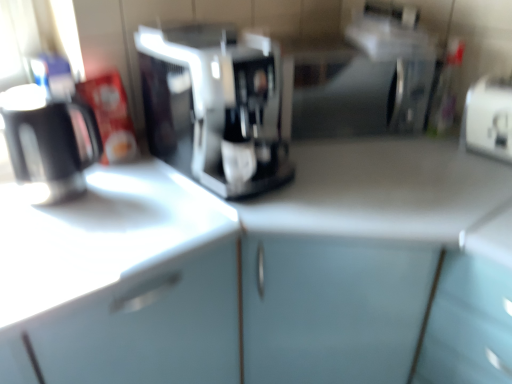
Describe the element at coordinates (97, 239) in the screenshot. The image size is (512, 384). I see `white glossy counter top at left` at that location.

Locate an element on the screen. sleek silver coffee maker at center is located at coordinates (214, 106).

Find the location of a particular element. kitchen appliance lying behind the sleek silver coffee maker at center is located at coordinates (47, 143).

Does matte black mug at left have a greater height compared to sleek silver coffee maker at center?

No, matte black mug at left is not taller than sleek silver coffee maker at center.

Is matte black mug at left outside of sleek silver coffee maker at center?

Yes, matte black mug at left is not within sleek silver coffee maker at center.

From the picture: Does matte black mug at left turn towards sleek silver coffee maker at center?

No, matte black mug at left is not turned towards sleek silver coffee maker at center.

Who is shorter, white glossy counter top at left or matte black mug at left?

With less height is matte black mug at left.

Does white glossy counter top at left come behind matte black mug at left?

No.

Is white glossy counter top at left looking in the opposite direction of matte black mug at left?

No, white glossy counter top at left is not facing away from matte black mug at left.

Considering the sizes of white glossy counter top at left and matte black mug at left in the image, is white glossy counter top at left bigger or smaller than matte black mug at left?

Clearly, white glossy counter top at left is larger in size than matte black mug at left.

Can you tell me how much sleek silver coffee maker at center and white glossy counter top at left differ in facing direction?

They differ by 1.23 degrees in their facing directions.

Is sleek silver coffee maker at center next to white glossy counter top at left?

sleek silver coffee maker at center and white glossy counter top at left are clearly separated.

From the image's perspective, is sleek silver coffee maker at center under white glossy counter top at left?

Actually, sleek silver coffee maker at center appears above white glossy counter top at left in the image.

Which of these two, sleek silver coffee maker at center or white glossy counter top at left, is wider?

white glossy counter top at left.

Is white plastic toaster at right further to camera compared to white glossy counter top at left?

Yes.

How distant is white plastic toaster at right from white glossy counter top at left?

white plastic toaster at right and white glossy counter top at left are 37.41 inches apart from each other.

From a real-world perspective, which is physically above, white plastic toaster at right or white glossy counter top at left?

white plastic toaster at right.

Can you confirm if white plastic toaster at right is taller than white glossy counter top at left?

Incorrect, the height of white plastic toaster at right is not larger of that of white glossy counter top at left.

From the image's perspective, between white glossy counter top at left and white plastic toaster at right, which one is located above?

white plastic toaster at right appears higher in the image.

Is white glossy counter top at left aimed at white plastic toaster at right?

No, white glossy counter top at left is not facing towards white plastic toaster at right.

Is white glossy counter top at left bigger than white plastic toaster at right?

Indeed, white glossy counter top at left has a larger size compared to white plastic toaster at right.

Based on the photo, from a real-world perspective, does white glossy counter top at left stand above white plastic toaster at right?

No, from a real-world perspective, white glossy counter top at left is not over white plastic toaster at right

Is white glossy counter top at left oriented towards sleek silver coffee maker at center?

No, white glossy counter top at left is not facing towards sleek silver coffee maker at center.

Is white glossy counter top at left inside or outside of sleek silver coffee maker at center?

white glossy counter top at left is spatially situated outside sleek silver coffee maker at center.

Between white glossy counter top at left and sleek silver coffee maker at center, which one appears on the left side from the viewer's perspective?

Positioned to the left is white glossy counter top at left.

Looking at the image, does white plastic toaster at right seem bigger or smaller compared to matte black mug at left?

In the image, white plastic toaster at right appears to be smaller than matte black mug at left.

In the scene shown: Which of these two, white plastic toaster at right or matte black mug at left, stands shorter?

white plastic toaster at right.

Identify the location of appliance on the right of matte black mug at left. (488, 118).

This screenshot has width=512, height=384. I want to click on coffee maker above the matte black mug at left (from the image's perspective), so click(x=214, y=106).

This screenshot has width=512, height=384. I want to click on counter top to the right of matte black mug at left, so click(x=97, y=239).

Estimate the real-world distances between objects in this image. Which object is closer to white plastic toaster at right, white glossy counter top at left or sleek silver coffee maker at center?

The object closer to white plastic toaster at right is sleek silver coffee maker at center.

Estimate the real-world distances between objects in this image. Which object is closer to white plastic toaster at right, sleek silver coffee maker at center or matte black mug at left?

The object closer to white plastic toaster at right is sleek silver coffee maker at center.

Estimate the real-world distances between objects in this image. Which object is closer to matte black mug at left, white glossy counter top at left or white plastic toaster at right?

white glossy counter top at left lies closer to matte black mug at left than the other object.

When comparing their distances from white glossy counter top at left, does sleek silver coffee maker at center or matte black mug at left seem further?

sleek silver coffee maker at center is positioned further to the anchor white glossy counter top at left.

When comparing their distances from white plastic toaster at right, does matte black mug at left or sleek silver coffee maker at center seem further?

The object further to white plastic toaster at right is matte black mug at left.

When comparing their distances from white glossy counter top at left, does matte black mug at left or sleek silver coffee maker at center seem closer?

matte black mug at left is closer to white glossy counter top at left.

From the image, which object appears to be farther from matte black mug at left, white glossy counter top at left or sleek silver coffee maker at center?

Based on the image, sleek silver coffee maker at center appears to be further to matte black mug at left.

From the image, which object appears to be nearer to matte black mug at left, sleek silver coffee maker at center or white plastic toaster at right?

sleek silver coffee maker at center is positioned closer to the anchor matte black mug at left.

Where is `coffee maker between white glossy counter top at left and white plastic toaster at right in the horizontal direction`? The width and height of the screenshot is (512, 384). coffee maker between white glossy counter top at left and white plastic toaster at right in the horizontal direction is located at coordinates (214, 106).

This screenshot has width=512, height=384. I want to click on coffee maker between matte black mug at left and white plastic toaster at right, so click(x=214, y=106).

Where is `kitchen appliance that lies between sleek silver coffee maker at center and white glossy counter top at left from top to bottom`? kitchen appliance that lies between sleek silver coffee maker at center and white glossy counter top at left from top to bottom is located at coordinates (47, 143).

The height and width of the screenshot is (384, 512). What are the coordinates of `counter top situated between matte black mug at left and white plastic toaster at right from left to right` in the screenshot? It's located at (97, 239).